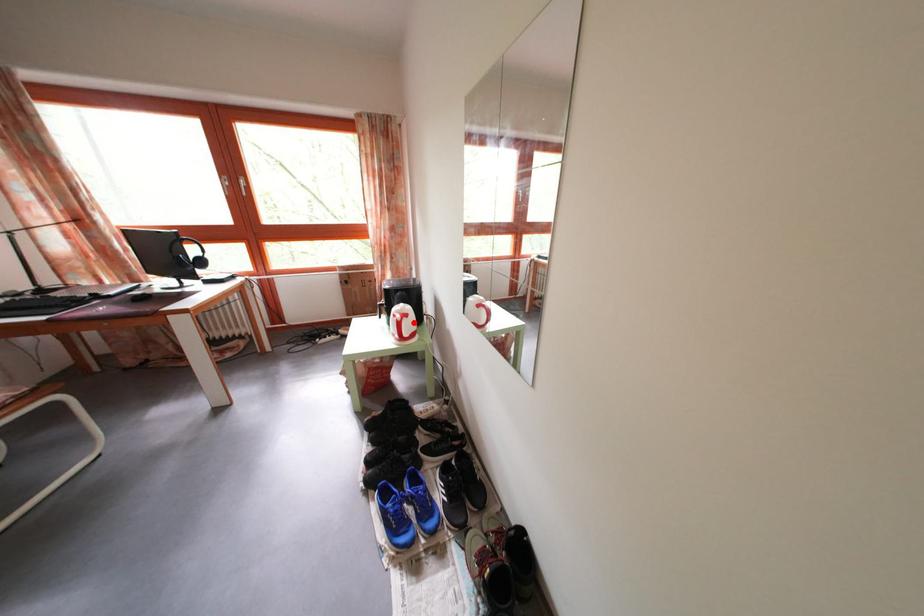
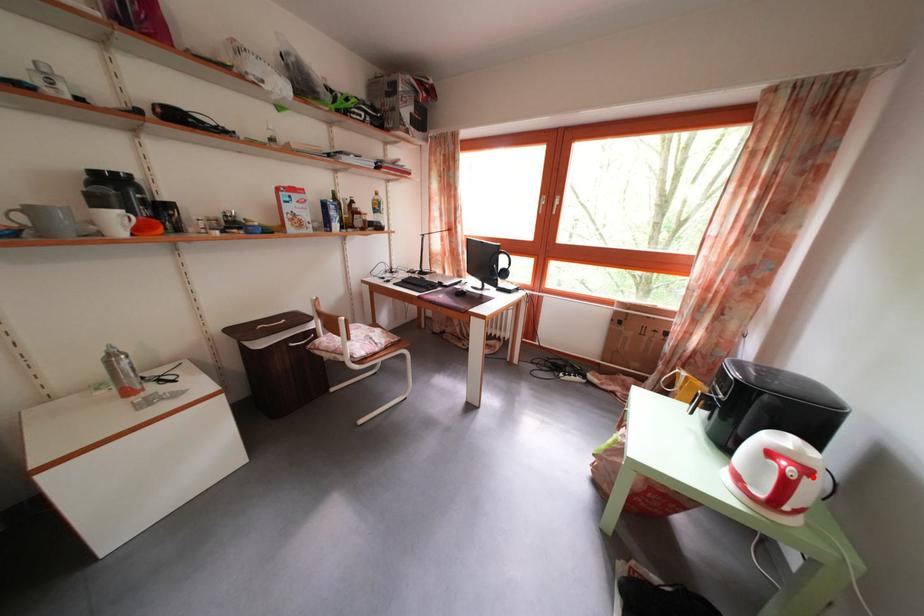
I am providing you with two images of the same scene from different viewpoints. A red point is marked on the first image and another point is marked on the second image. Is the red point in image1 aligned with the point shown in image2?

Yes